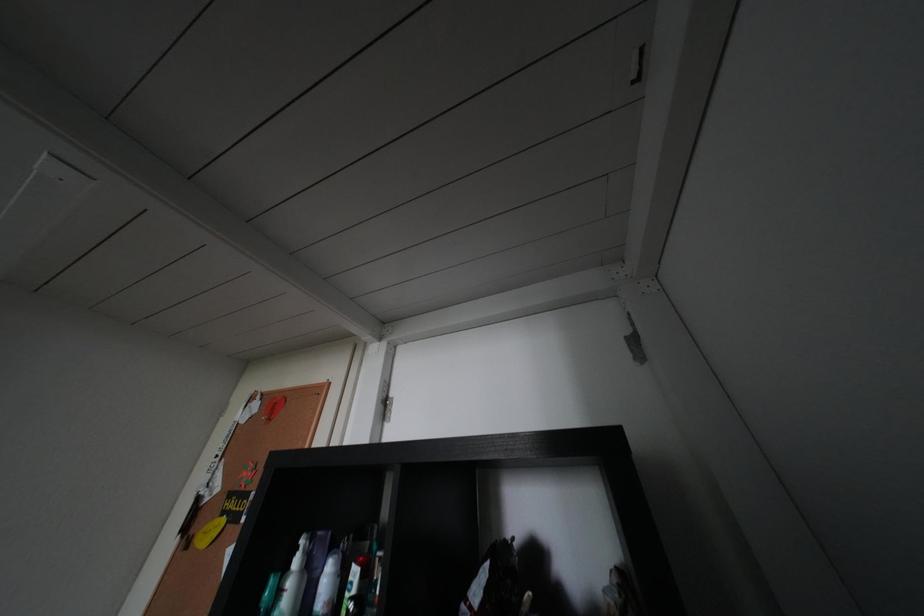
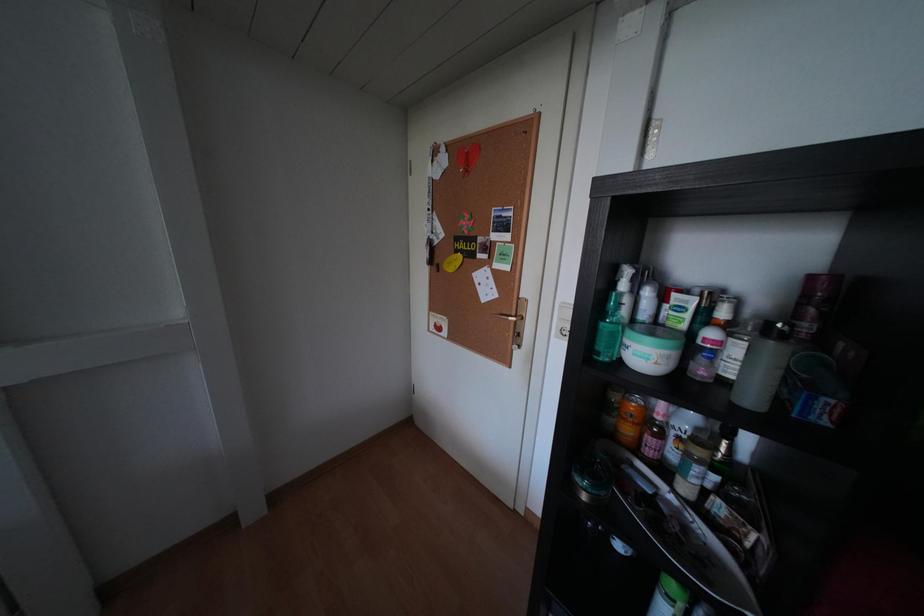
The images are taken continuously from a first-person perspective. In which direction is your viewpoint rotating?

The camera rotated toward left-down.